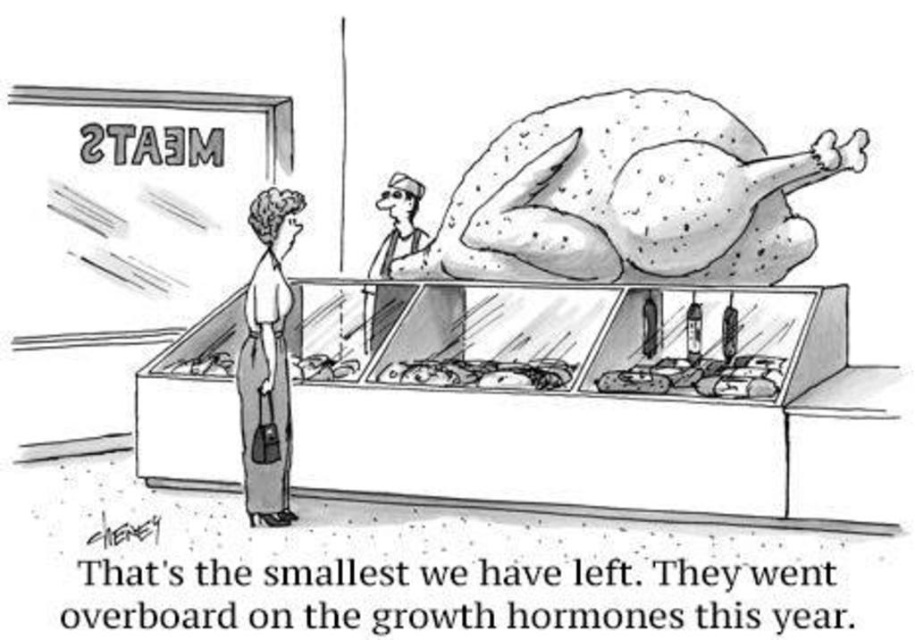
Consider the image. You are a customer at the meat counter and want to know if the smooth skin worker at upper center can fit through a doorway that is the same width as the shiny silver fish at center. Can they?

The smooth skin worker at upper center is narrower than the shiny silver fish at center, so they can fit through the doorway.

You are a customer at the meat counter and want to ask the worker about the price of the meat. Which direction should you turn your head to look at the smooth skin worker at upper center while facing the smooth beige pants at lower left?

The smooth beige pants at lower left is positioned on the left side of smooth skin worker at upper center, so you should turn your head to the right to look at the smooth skin worker at upper center while facing the smooth beige pants at lower left.